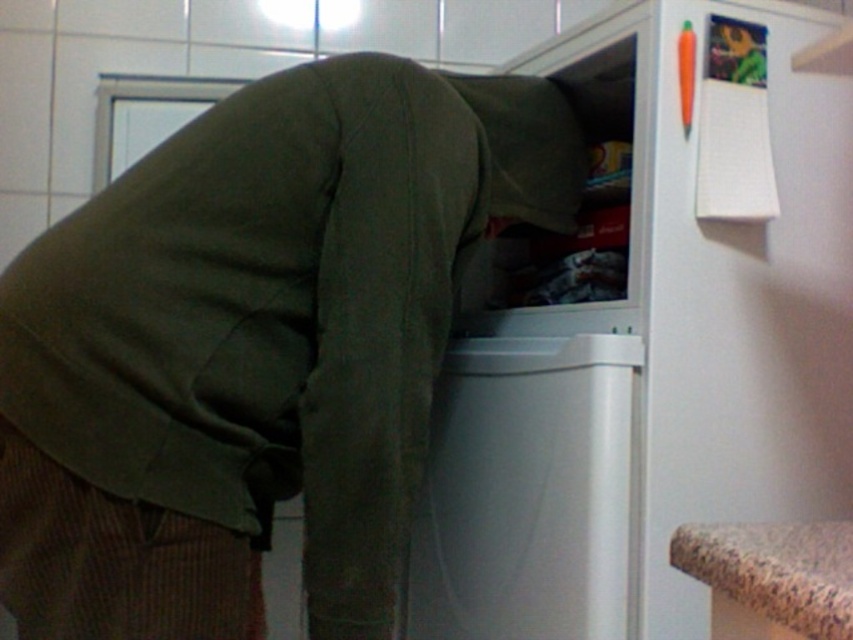
Does dark green hoodie at center appear on the left side of granite countertop at lower right?

Correct, you'll find dark green hoodie at center to the left of granite countertop at lower right.

Does dark green hoodie at center appear under granite countertop at lower right?

No, dark green hoodie at center is not below granite countertop at lower right.

The height and width of the screenshot is (640, 853). I want to click on dark green hoodie at center, so click(x=254, y=346).

Does white matte refrigerator at center have a smaller size compared to white plastic dishwasher at center?

No.

Between white matte refrigerator at center and white plastic dishwasher at center, which one is positioned lower?

white plastic dishwasher at center

Locate an element on the screen. This screenshot has height=640, width=853. white matte refrigerator at center is located at coordinates (648, 340).

Who is lower down, white matte refrigerator at center or granite countertop at lower right?

Positioned lower is granite countertop at lower right.

Identify the location of white matte refrigerator at center. This screenshot has width=853, height=640. (648, 340).

Which is in front, point (521, 296) or point (837, 605)?

Positioned in front is point (837, 605).

The image size is (853, 640). I want to click on white matte refrigerator at center, so click(x=648, y=340).